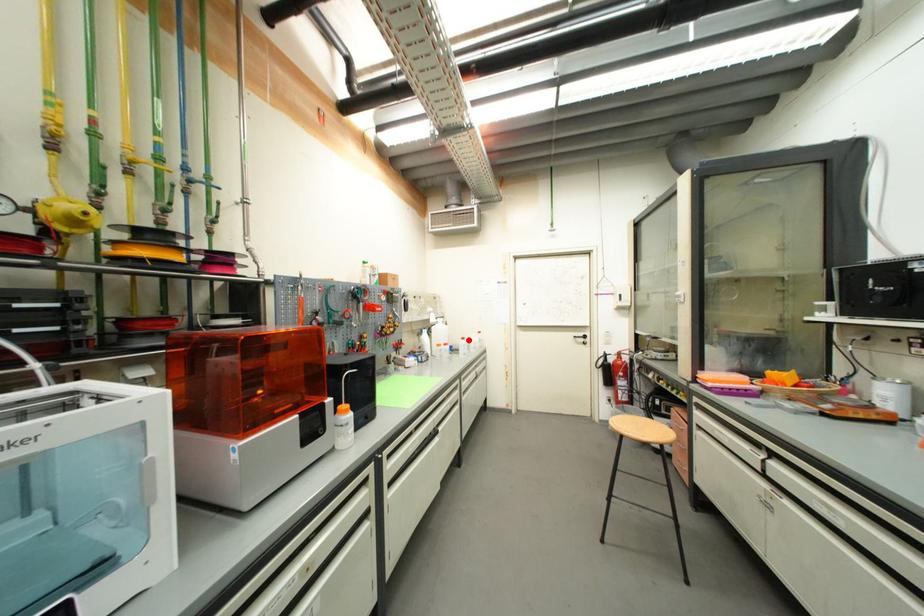
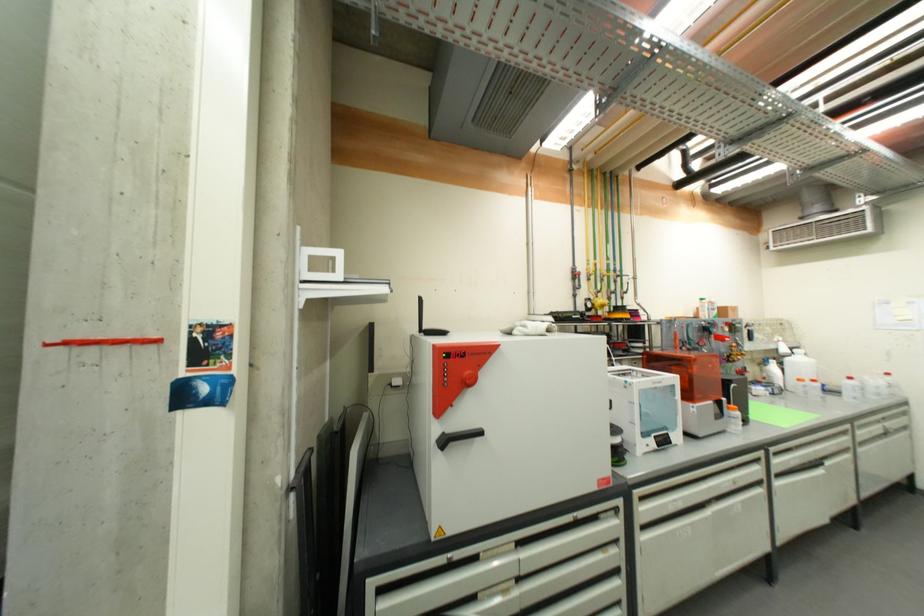
Find the pixel in the second image that matches the highlighted location in the first image.

(856, 379)